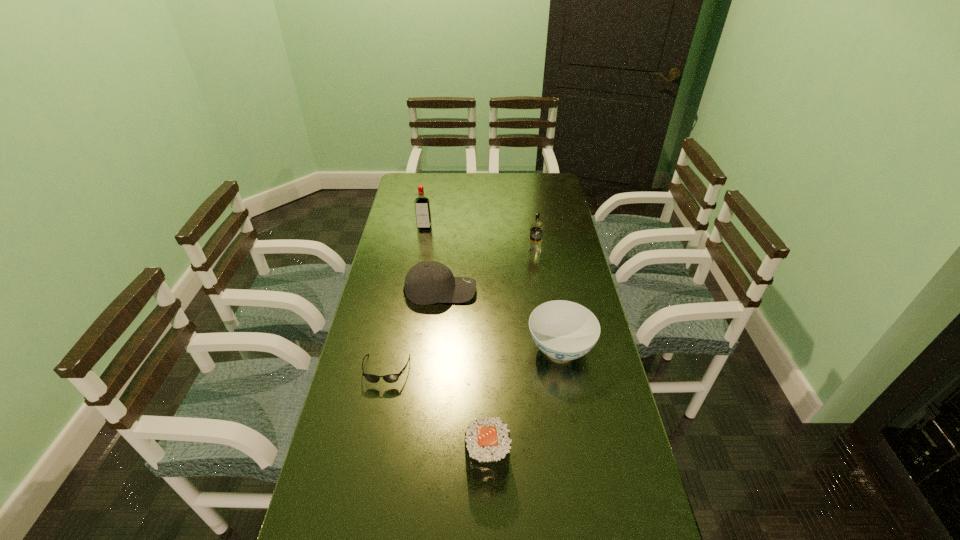
The width and height of the screenshot is (960, 540). I want to click on unoccupied area between the chinaware and the baseball cap, so click(x=500, y=319).

Where is `vacant region between the baseball cap and the farthest object`? vacant region between the baseball cap and the farthest object is located at coordinates (432, 259).

Identify the location of free spot between the third farthest object and the fifth nearest object. The height and width of the screenshot is (540, 960). (488, 271).

What are the coordinates of `the closest object relative to the left vodka` in the screenshot? It's located at (427, 282).

Point out which object is positioned as the nearest to the sunglasses. Please provide its 2D coordinates. Your answer should be formatted as a tuple, i.e. [(x, y)], where the tuple contains the x and y coordinates of a point satisfying the conditions above.

[(427, 282)]

At what (x,y) coordinates should I click in order to perform the action: click on free space that satisfies the following two spatial constraints: 1. on the front brim of the nearest object; 2. on the left side of the baseball cap. Please return your answer as a coordinate pair (x, y). This screenshot has height=540, width=960. Looking at the image, I should click on (423, 460).

This screenshot has width=960, height=540. I want to click on free location that satisfies the following two spatial constraints: 1. on the front and back of the farther vodka; 2. on the right side of the nearest object, so click(386, 460).

At what (x,y) coordinates should I click in order to perform the action: click on free space that satisfies the following two spatial constraints: 1. on the front brim of the fourth nearest object; 2. on the front-facing side of the sunglasses. Please return your answer as a coordinate pair (x, y). The width and height of the screenshot is (960, 540). Looking at the image, I should click on (432, 370).

You are a GUI agent. You are given a task and a screenshot of the screen. Output one action in this format:
    pyautogui.click(x=<x>, y=<y>)
    Task: Click on the vacant space that satisfies the following two spatial constraints: 1. on the front and back of the chinaware; 2. on the left side of the left vodka
    Image resolution: width=960 pixels, height=540 pixels.
    Given the screenshot: What is the action you would take?
    pyautogui.click(x=404, y=348)